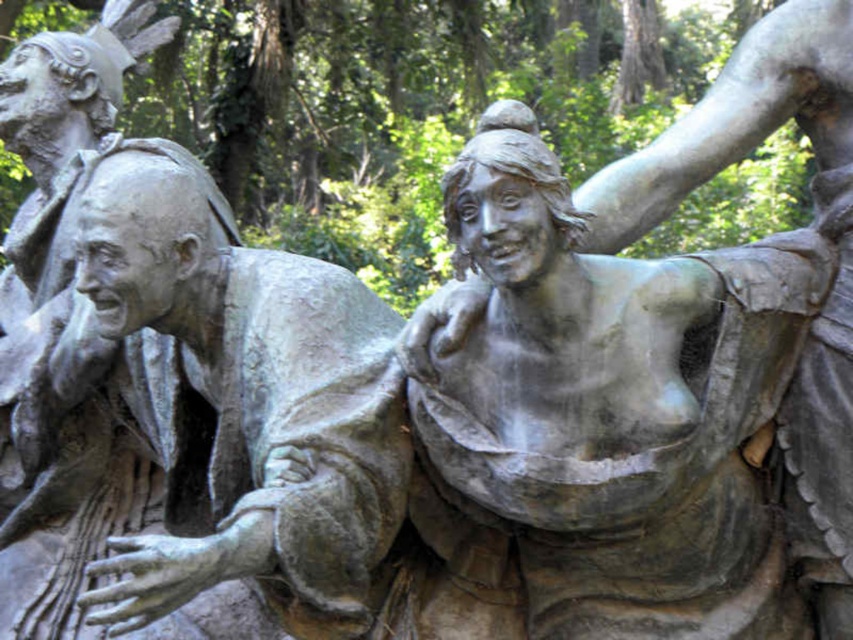
Can you confirm if bronze statue at center is wider than bronze statue at left?

Yes, bronze statue at center is wider than bronze statue at left.

Is bronze statue at center to the left of bronze statue at left from the viewer's perspective?

No, bronze statue at center is not to the left of bronze statue at left.

In order to click on bronze statue at center in this screenshot , I will do `click(660, 464)`.

Where is `bronze statue at center`? This screenshot has height=640, width=853. bronze statue at center is located at coordinates (660, 464).